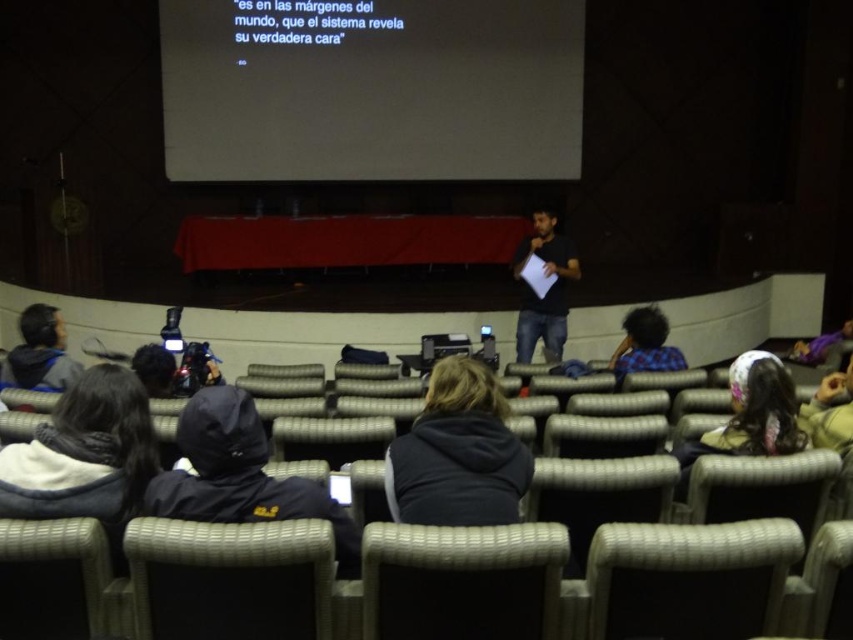
Does black matte screen at upper center appear over dark blue hoodie at lower left?

Indeed, black matte screen at upper center is positioned over dark blue hoodie at lower left.

Is black matte screen at upper center to the left of dark blue hoodie at lower left from the viewer's perspective?

In fact, black matte screen at upper center is to the right of dark blue hoodie at lower left.

I want to click on black matte screen at upper center, so click(x=370, y=90).

Which of these two, textured fabric chair at center or dark gray hoodie at center, stands taller?

Standing taller between the two is dark gray hoodie at center.

Who is more distant from viewer, [531,621] or [517,518]?

Positioned behind is point [517,518].

This screenshot has width=853, height=640. I want to click on textured fabric chair at center, so click(462, 580).

Which is more to the right, black matte screen at upper center or textured fabric chair at center?

From the viewer's perspective, textured fabric chair at center appears more on the right side.

Is point (570, 108) closer to viewer compared to point (502, 540)?

No, it is not.

I want to click on black matte screen at upper center, so [x=370, y=90].